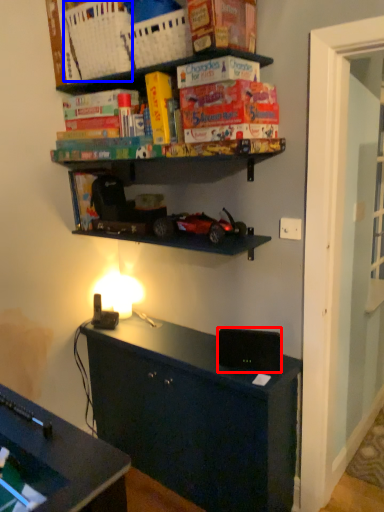
Question: Which object appears closest to the camera in this image, speaker (highlighted by a red box) or basket (highlighted by a blue box)?

Choices:
 (A) speaker
 (B) basket

Answer: (B)